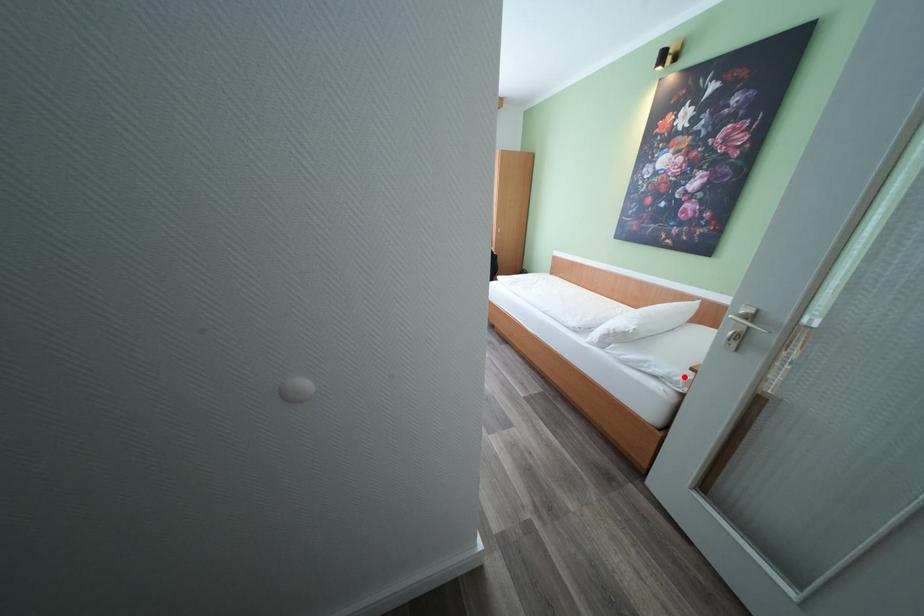
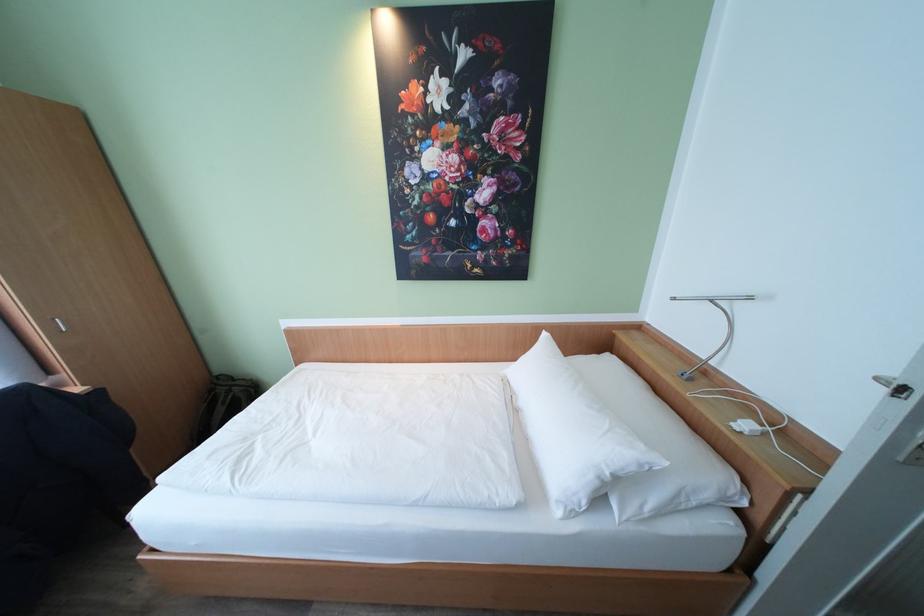
Where in the second image is the point corresponding to the highlighted location from the first image?

(736, 488)